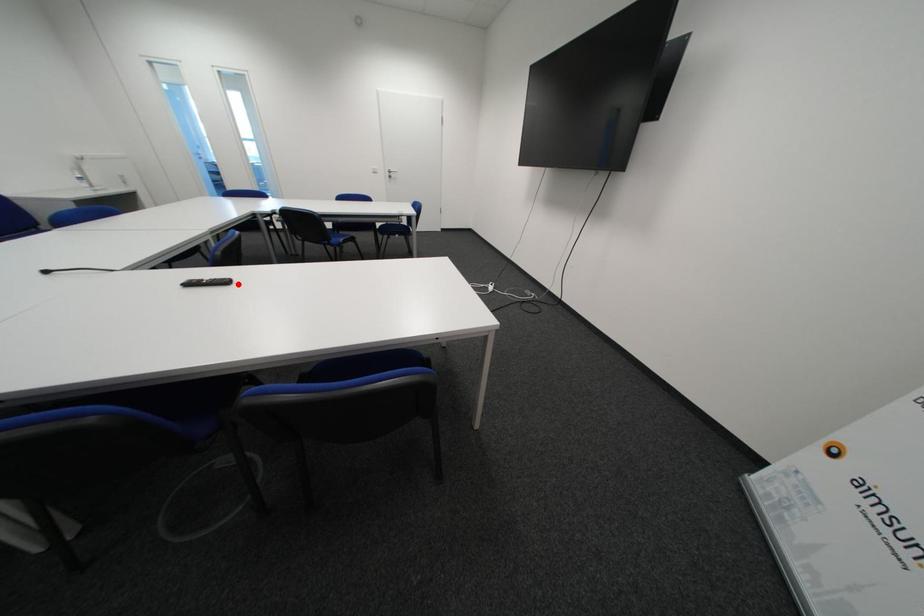
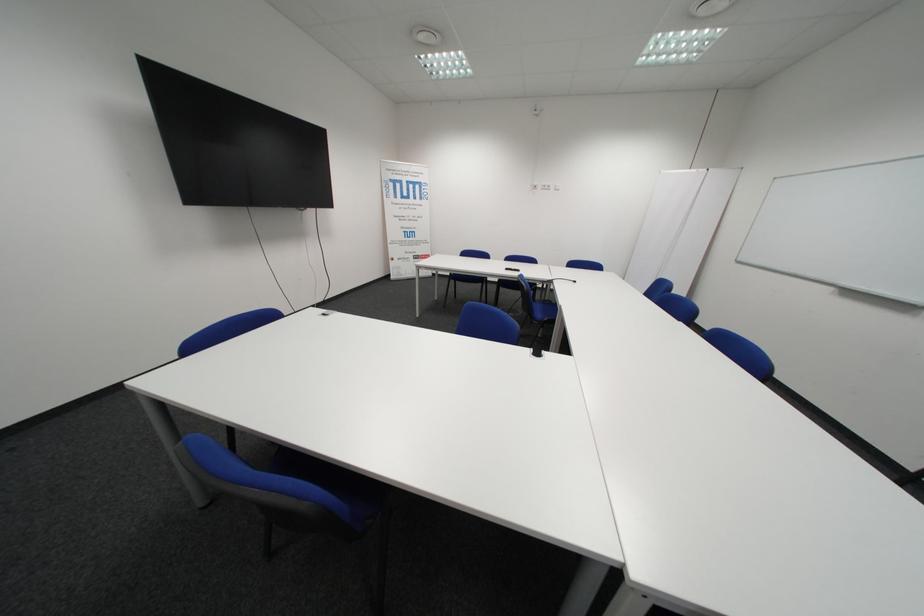
The point at the highlighted location is marked in the first image. Where is the corresponding point in the second image?

(518, 270)